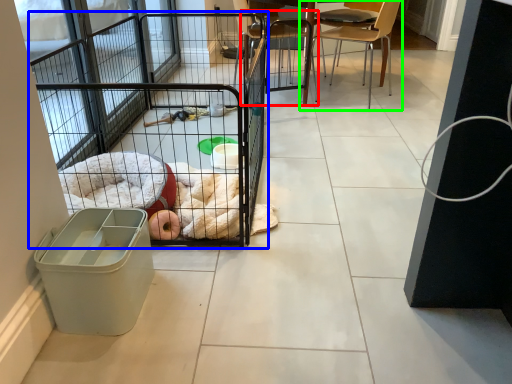
Question: Considering the real-world distances, which object is closest to chair (highlighted by a red box)? cage (highlighted by a blue box) or chair (highlighted by a green box).

Choices:
 (A) cage
 (B) chair

Answer: (B)